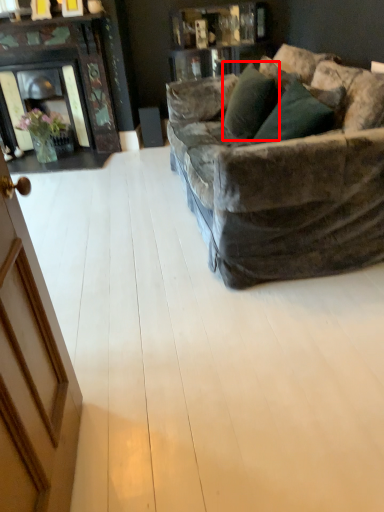
Question: From the image's perspective, where is pillow (annotated by the red box) located in relation to plywood in the image?

Choices:
 (A) below
 (B) above

Answer: (B)